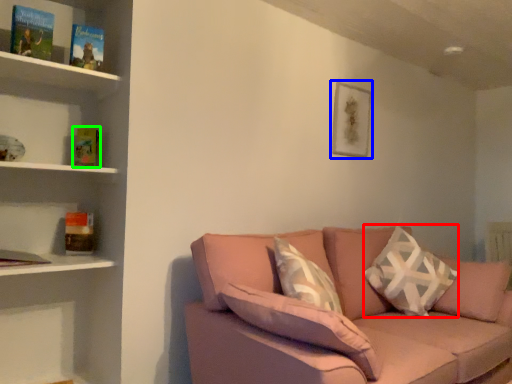
Question: Which is nearer to the throw pillow (highlighted by a red box)? picture frame (highlighted by a blue box) or paperback book (highlighted by a green box).

Choices:
 (A) picture frame
 (B) paperback book

Answer: (A)